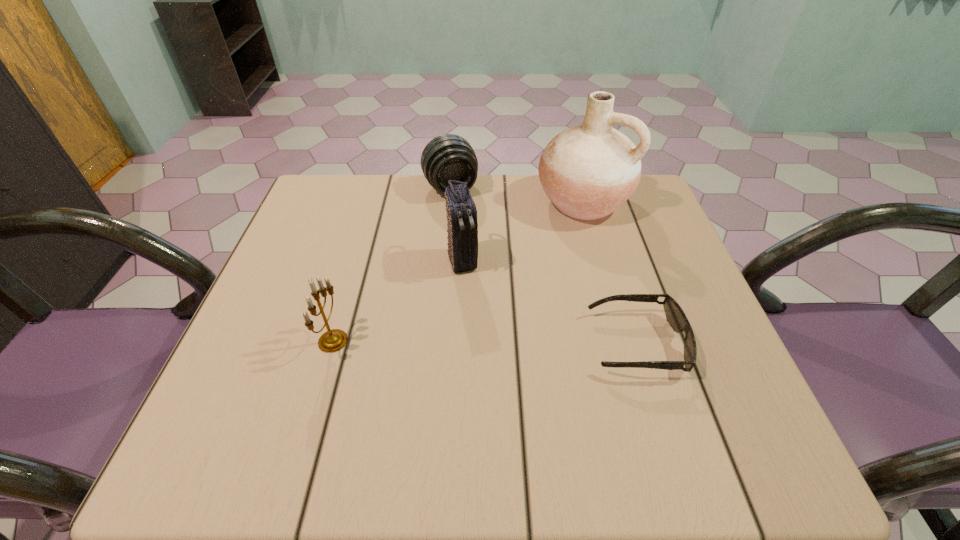
Find the location of a particular element. This screenshot has width=960, height=540. object positioned at the near edge is located at coordinates (675, 316).

In order to click on object present at the left edge in this screenshot , I will do `click(333, 340)`.

Locate an element on the screen. This screenshot has width=960, height=540. sunglasses that is at the right edge is located at coordinates (675, 316).

Image resolution: width=960 pixels, height=540 pixels. I want to click on pottery that is at the right edge, so click(588, 171).

Find the location of a particular element. This screenshot has height=540, width=960. object present at the far right corner is located at coordinates (588, 171).

You are a GUI agent. You are given a task and a screenshot of the screen. Output one action in this format:
    pyautogui.click(x=<x>, y=<y>)
    Task: Click on the object at the near right corner
    The image size is (960, 540).
    Given the screenshot: What is the action you would take?
    pyautogui.click(x=675, y=316)

Identify the location of free space at the far edge. (512, 179).

In the image, there is a desktop. Where is `vacant region at the near edge`? This screenshot has width=960, height=540. vacant region at the near edge is located at coordinates (342, 415).

Locate an element on the screen. vacant region at the left edge of the desktop is located at coordinates (271, 293).

The height and width of the screenshot is (540, 960). Find the location of `vacant region at the right edge of the desktop`. vacant region at the right edge of the desktop is located at coordinates [661, 286].